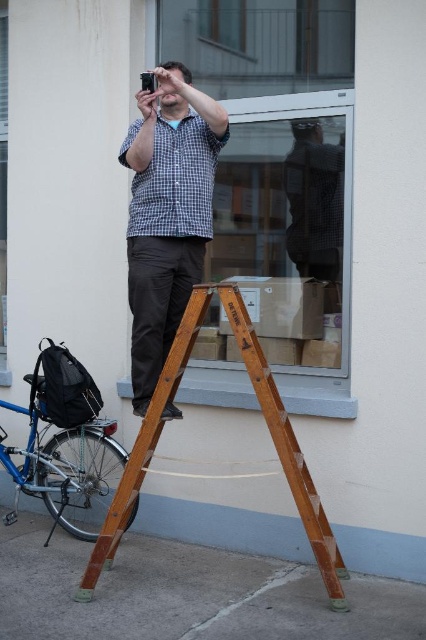
Between point (121, 481) and point (336, 216), which one is positioned in front?

Point (121, 481) is in front.

Between wooden at center and checkered fabric shirt at upper center, which one is positioned higher?

checkered fabric shirt at upper center is higher up.

Is point (261, 378) behind point (339, 243)?

No.

Where is `wooden at center`? This screenshot has width=426, height=640. wooden at center is located at coordinates (267, 428).

Is blue metallic bicycle at lower left wider than checkered fabric shirt at upper center?

Yes.

Does point (118, 458) lie in front of point (310, 148)?

Yes, it is.

Which is behind, point (89, 448) or point (298, 216)?

The point (89, 448) is behind.

This screenshot has width=426, height=640. I want to click on blue metallic bicycle at lower left, so click(66, 467).

Is checkered fabric shirt at center thinner than wooden at center?

Yes, checkered fabric shirt at center is thinner than wooden at center.

Can you confirm if checkered fabric shirt at center is shorter than wooden at center?

In fact, checkered fabric shirt at center may be taller than wooden at center.

Does point (150, 344) lie behind point (253, 381)?

Yes.

Find the location of `checkered fabric shirt at center`. checkered fabric shirt at center is located at coordinates (166, 212).